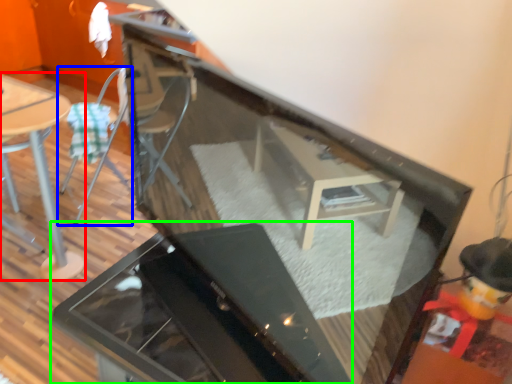
Question: Which is nearer to the table (highlighted by a red box)? chair (highlighted by a blue box) or grill (highlighted by a green box).

Choices:
 (A) chair
 (B) grill

Answer: (A)